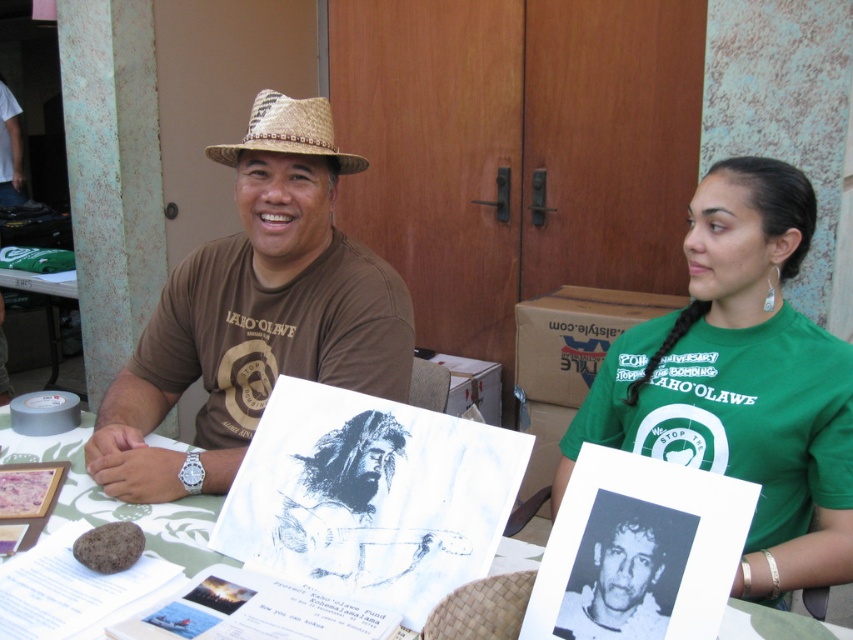
You are a photographer at the event and need to position a microphone stand between the green fabric shirt at upper right and the white paper at center. Based on their positions, which object should the stand be placed closer to?

The microphone stand should be placed closer to the white paper at center because the green fabric shirt at upper right is to the right of the white paper at center, meaning the white paper is on the left side relative to the shirt. Therefore, placing the stand closer to the white paper ensures it is between them.

You are standing in front of the table where the two people are sitting. Where is the white paper at center located?

The white paper at center is located at point (117, 500).